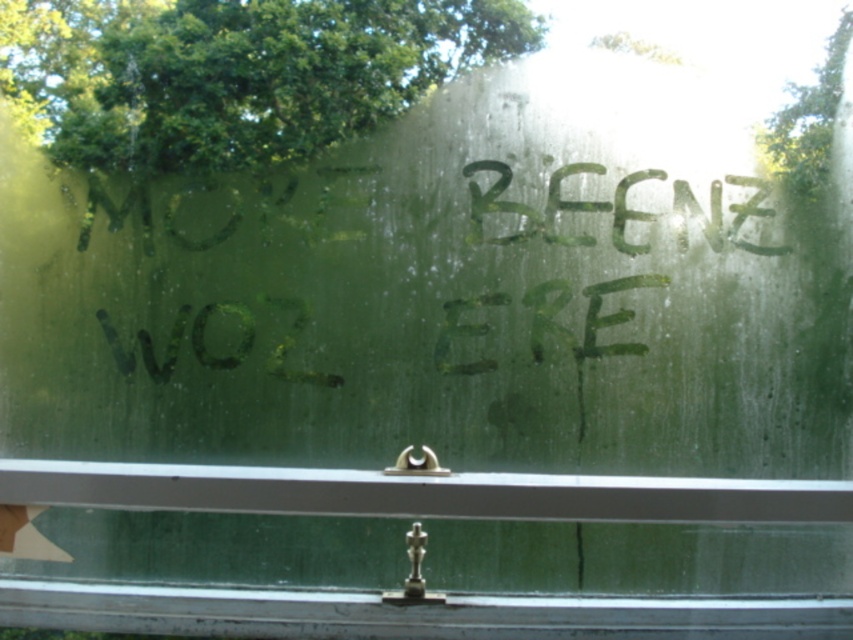
Is point (212, 592) farther from camera compared to point (567, 237)?

No, it is not.

Who is positioned more to the right, metallic silver window sill at lower center or green paint at center?

green paint at center

Between point (447, 608) and point (712, 228), which one is positioned in front?

Point (447, 608)

Identify the location of metallic silver window sill at lower center. (407, 612).